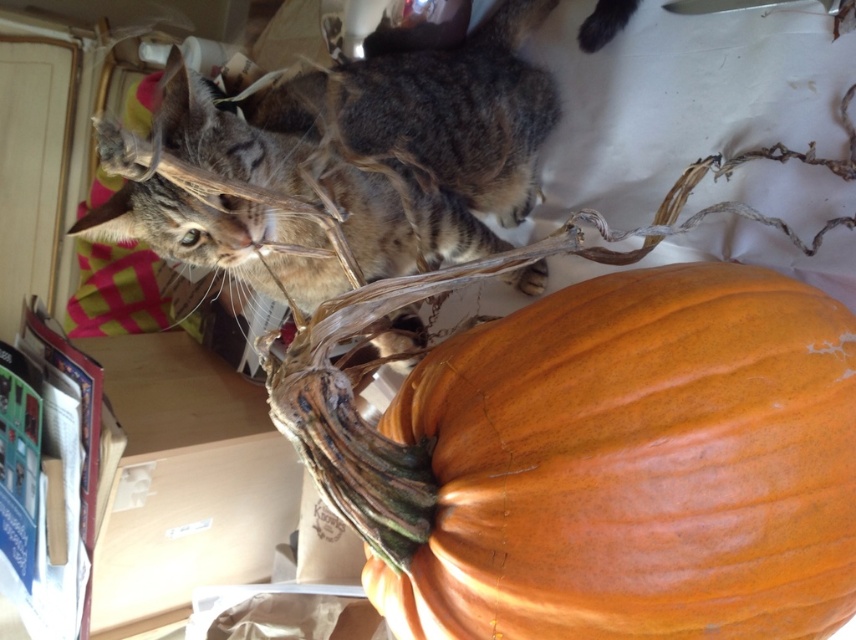
Which is behind, point (508, 563) or point (176, 477)?

The point (176, 477) is behind.

Does orange matte pumpkin at center appear on the left side of wooden table at lower left?

Incorrect, orange matte pumpkin at center is not on the left side of wooden table at lower left.

Between point (646, 364) and point (120, 612), which one is positioned in front?

Point (646, 364) is more forward.

At what (x,y) coordinates should I click in order to perform the action: click on orange matte pumpkin at center. Please return your answer as a coordinate pair (x, y). This screenshot has height=640, width=856. Looking at the image, I should click on (635, 465).